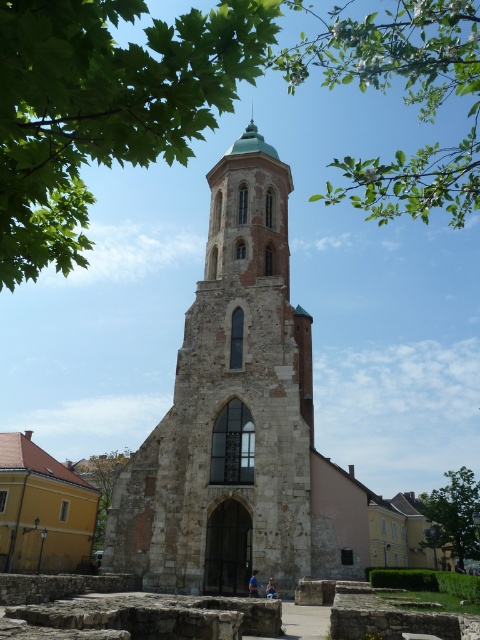
You are standing at the entrance of the historic stone church and looking towards the tower. You notice two green leafy trees in the scene. Which tree, the green leafy tree at upper center or the green leafy tree at lower right, is closer to you?

The green leafy tree at upper center is closer to you because it is positioned in front of the green leafy tree at lower right.

You are standing at the entrance of the historic stone church and want to take a photo that includes both the green leafy tree at lower right and the green leafy tree at lower left. Which tree should you move closer to in order to include both trees in the frame without cropping either?

To include both the green leafy tree at lower right and the green leafy tree at lower left in the frame without cropping, you should move closer to the green leafy tree at lower left since it is smaller and requires less space in the photo compared to the larger tree at lower right.

Looking at this image, you are standing at the entrance of the historic stone church and want to take a photo that includes both the green leafy tree at lower right and the green leafy tree at lower left. Which tree should you frame wider in your shot to accurately represent their actual sizes?

The green leafy tree at lower right should be framed wider in the photo because its width surpasses that of the green leafy tree at lower left, making it larger in actual size.